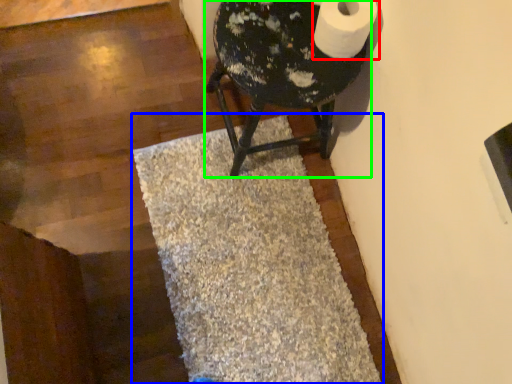
Question: Which object is the closest to the toilet paper (highlighted by a red box)? Choose among these: bath mat (highlighted by a blue box) or furniture (highlighted by a green box).

Choices:
 (A) bath mat
 (B) furniture

Answer: (B)